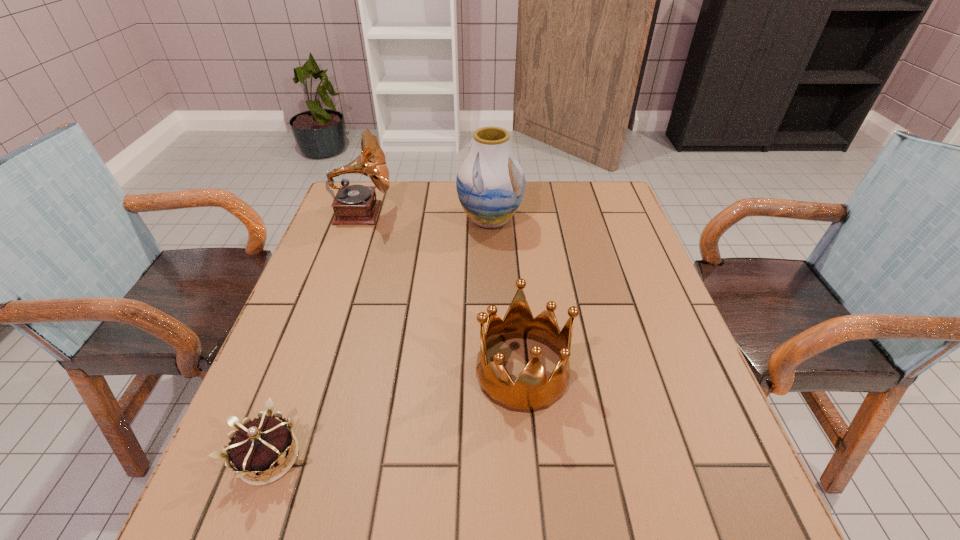
This screenshot has height=540, width=960. Find the location of `vacant area at the near left corner of the desktop`. vacant area at the near left corner of the desktop is located at coordinates (192, 532).

At what (x,y) coordinates should I click in order to perform the action: click on vacant space at the far right corner of the desktop. Please return your answer as a coordinate pair (x, y). The width and height of the screenshot is (960, 540). Looking at the image, I should click on (588, 216).

Locate an element on the screen. The image size is (960, 540). free spot between the nearest object and the right crown is located at coordinates (396, 414).

The image size is (960, 540). Identify the location of vacant space that's between the left crown and the vase. (379, 339).

This screenshot has width=960, height=540. What are the coordinates of `vacant space in between the nearest object and the vase` in the screenshot? It's located at (379, 339).

The height and width of the screenshot is (540, 960). What are the coordinates of `vacant area between the vase and the phonograph_record` in the screenshot? It's located at (426, 217).

At what (x,y) coordinates should I click in order to perform the action: click on vacant space in between the vase and the farther crown. Please return your answer as a coordinate pair (x, y). Looking at the image, I should click on (506, 296).

Identify the location of blank region between the second shortest object and the left crown. This screenshot has width=960, height=540. (396, 414).

This screenshot has width=960, height=540. Find the location of `free space that is in between the shortest object and the taller crown`. free space that is in between the shortest object and the taller crown is located at coordinates (396, 414).

This screenshot has width=960, height=540. I want to click on empty location between the nearer crown and the phonograph_record, so click(x=316, y=335).